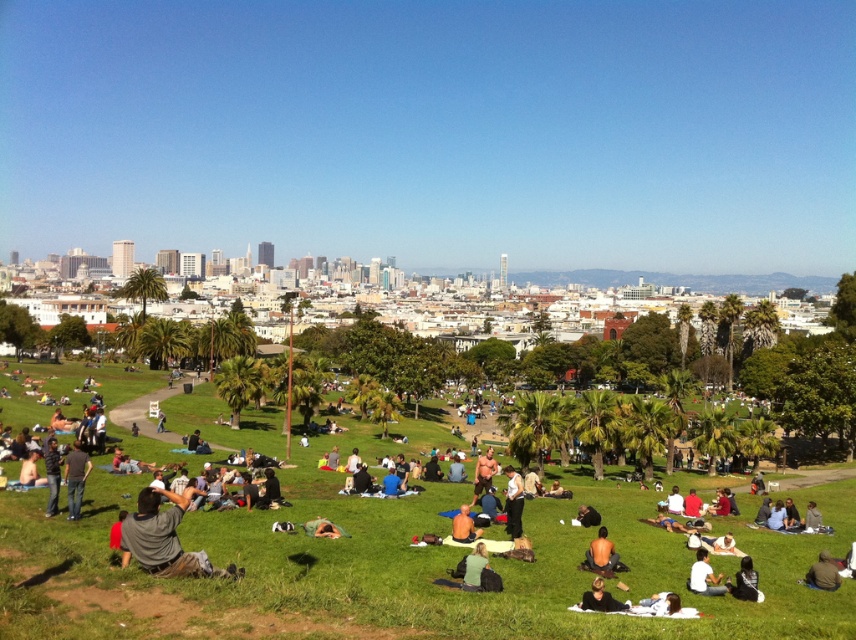
Is dark gray fabric shirt at lower left to the left of dark gray pants at center from the viewer's perspective?

Indeed, dark gray fabric shirt at lower left is positioned on the left side of dark gray pants at center.

Is point (159, 531) closer to viewer compared to point (512, 502)?

Yes, point (159, 531) is in front of point (512, 502).

Is point (137, 532) more distant than point (504, 472)?

No, (137, 532) is in front of (504, 472).

The width and height of the screenshot is (856, 640). I want to click on dark gray fabric shirt at lower left, so click(x=164, y=538).

Is point (70, 468) positioned after point (807, 516)?

No.

Is dark gray shirt at lower left thinner than dark gray jacket at center?

No.

Where is `dark gray shirt at lower left`? dark gray shirt at lower left is located at coordinates (75, 477).

Between dark gray fabric shirt at lower left and dark gray jacket at center, which one is positioned lower?

dark gray jacket at center

Does dark gray fabric shirt at lower left come in front of dark gray jacket at center?

Yes, it is in front of dark gray jacket at center.

Does point (140, 552) come farther from viewer compared to point (809, 518)?

That is False.

At what (x,y) coordinates should I click in order to perform the action: click on dark gray fabric shirt at lower left. Please return your answer as a coordinate pair (x, y). The width and height of the screenshot is (856, 640). Looking at the image, I should click on (164, 538).